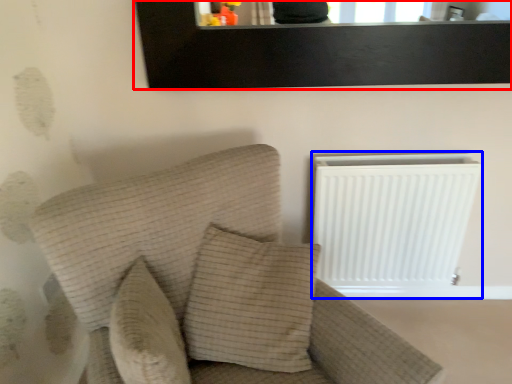
Question: Which object is further to the camera taking this photo, picture frame (highlighted by a red box) or radiator (highlighted by a blue box)?

Choices:
 (A) picture frame
 (B) radiator

Answer: (B)